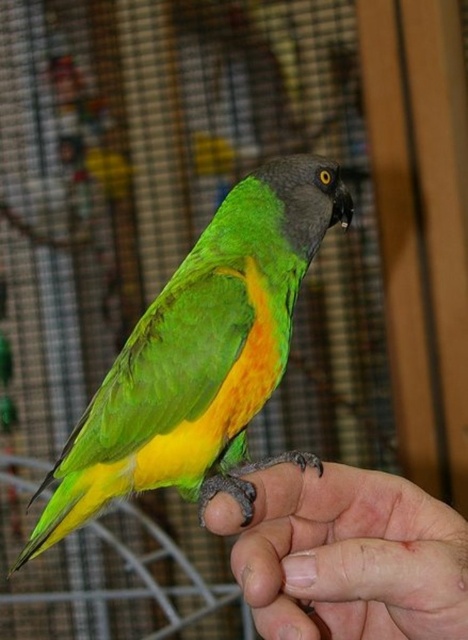
You are a veterinarian examining a parrot and its owner. You notice the green matte parrot at center and the smooth skin hand at lower right in the image. Based on their sizes, which one is bigger?

The green matte parrot at center has a larger size compared to the smooth skin hand at lower right, so the green matte parrot at center is bigger.

You are a bird trainer observing the scene. You need to determine if the green matte parrot at center can comfortably sit on the smooth skin hand at lower right. Based on their sizes, what is your conclusion?

The green matte parrot at center is wider than the smooth skin hand at lower right, so it may not comfortably sit on the hand due to its larger width.

You are a photographer trying to capture the green matte parrot at center and the smooth skin hand at lower right in a single frame. Based on their positions, which object should you focus on first to ensure both are in focus?

The green matte parrot at center is to the left of the smooth skin hand at lower right. Since the parrot is closer to the camera, focusing on it first will help ensure both are in focus.